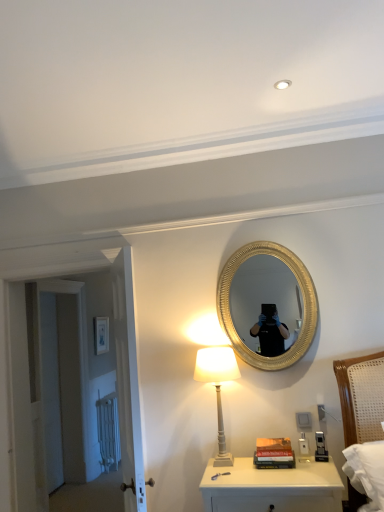
Where is `free space in front of hardcover books at center`? free space in front of hardcover books at center is located at coordinates (287, 474).